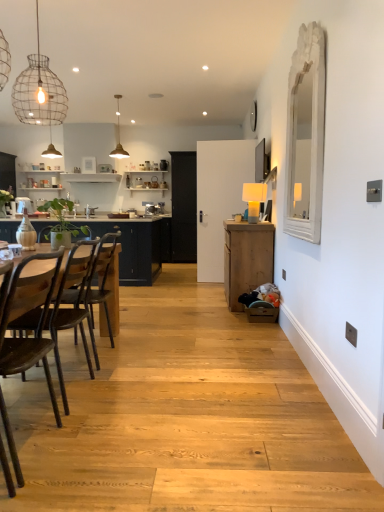
Question: Is wooden chair at left, arranged as the first chair when viewed from the back, positioned in front of metallic pendant light at upper center, marked as the second lamp in a bottom-to-top arrangement?

Choices:
 (A) yes
 (B) no

Answer: (A)

Question: Does wooden chair at left, the 3th chair viewed from the front, have a lesser width compared to metallic pendant light at upper center, the 1th lamp from the back?

Choices:
 (A) yes
 (B) no

Answer: (B)

Question: From the image's perspective, would you say wooden chair at left, the 3th chair viewed from the front, is positioned over metallic pendant light at upper center, marked as the second lamp in a bottom-to-top arrangement?

Choices:
 (A) yes
 (B) no

Answer: (B)

Question: Is wooden chair at left, the 3th chair viewed from the front, to the right of metallic pendant light at upper center, the 1th lamp from the back, from the viewer's perspective?

Choices:
 (A) yes
 (B) no

Answer: (A)

Question: From the image's perspective, does wooden chair at left, the 3th chair viewed from the front, appear lower than metallic pendant light at upper center, marked as the 2th lamp in a front-to-back arrangement?

Choices:
 (A) no
 (B) yes

Answer: (B)

Question: Is wooden chair at left, arranged as the first chair when viewed from the back, oriented away from metallic pendant light at upper center, marked as the second lamp in a bottom-to-top arrangement?

Choices:
 (A) no
 (B) yes

Answer: (A)

Question: Considering the relative sizes of wire mesh light fixture at upper left and dark brown wood chair at left, which is the 2th chair from front to back, in the image provided, is wire mesh light fixture at upper left smaller than dark brown wood chair at left, which is the 2th chair from front to back,?

Choices:
 (A) no
 (B) yes

Answer: (B)

Question: From the image's perspective, does wire mesh light fixture at upper left appear lower than dark brown wood chair at left, which is the 2th chair from front to back?

Choices:
 (A) no
 (B) yes

Answer: (A)

Question: Considering the relative sizes of wire mesh light fixture at upper left and dark brown wood chair at left, which is the 2th chair from front to back, in the image provided, is wire mesh light fixture at upper left wider than dark brown wood chair at left, which is the 2th chair from front to back,?

Choices:
 (A) yes
 (B) no

Answer: (B)

Question: Is wire mesh light fixture at upper left aimed at dark brown wood chair at left, the 2th chair from the back?

Choices:
 (A) no
 (B) yes

Answer: (A)

Question: Is wire mesh light fixture at upper left further to the viewer compared to dark brown wood chair at left, the 2th chair from the back?

Choices:
 (A) no
 (B) yes

Answer: (B)

Question: Does wire mesh light fixture at upper left have a lesser width compared to dark brown wood chair at left, the 2th chair from the back?

Choices:
 (A) no
 (B) yes

Answer: (B)

Question: Is black glass door at center outside wire mesh light fixture at upper left?

Choices:
 (A) no
 (B) yes

Answer: (B)